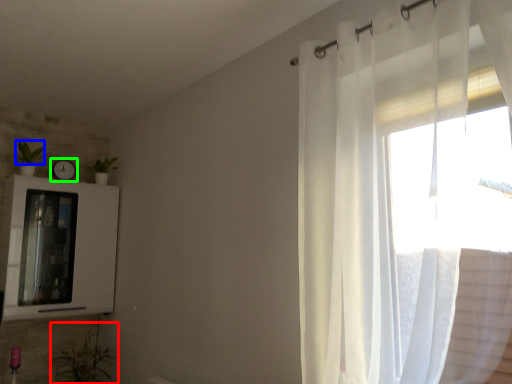
Question: Which object is the farthest from plant (highlighted by a red box)? Choose among these: plant (highlighted by a blue box) or clock (highlighted by a green box).

Choices:
 (A) plant
 (B) clock

Answer: (A)